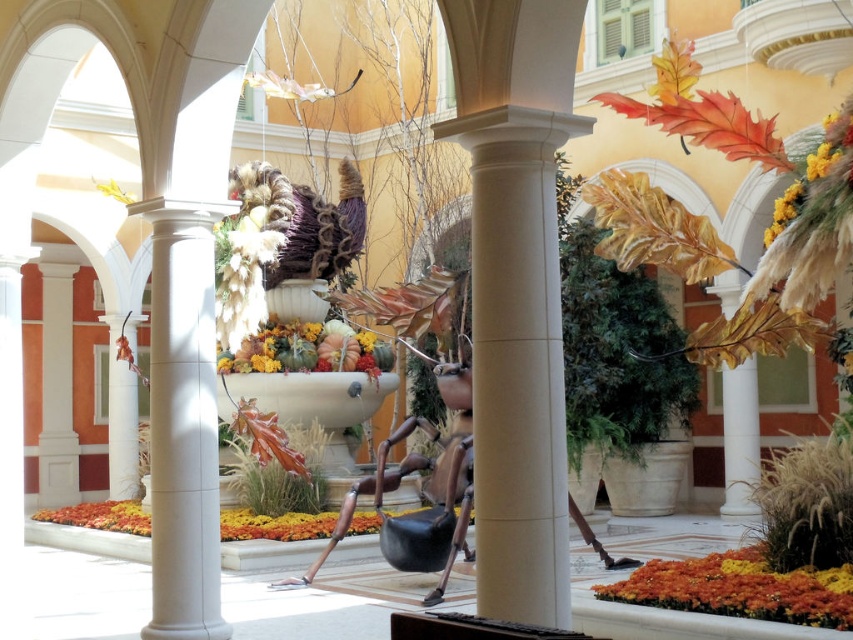
Question: Estimate the real-world distances between objects in this image. Which object is closer to the white smooth column at center?

Choices:
 (A) orange matte flowers at lower right
 (B) multicolored fabric bouquet at center
 (C) metallic gold sculpture at center

Answer: (A)

Question: Can you confirm if white smooth column at center is positioned to the left of orange matte flowers at lower right?

Choices:
 (A) yes
 (B) no

Answer: (A)

Question: Where is orange matte flowers at lower right located in relation to metallic gold sculpture at center in the image?

Choices:
 (A) left
 (B) right

Answer: (B)

Question: Which point is closer to the camera taking this photo?

Choices:
 (A) (x=486, y=262)
 (B) (x=735, y=573)
 (C) (x=297, y=348)

Answer: (A)

Question: Does orange matte flowers at lower right have a larger size compared to metallic gold sculpture at center?

Choices:
 (A) yes
 (B) no

Answer: (B)

Question: Which of the following is the closest to the observer?

Choices:
 (A) (425, 465)
 (B) (332, 365)

Answer: (A)